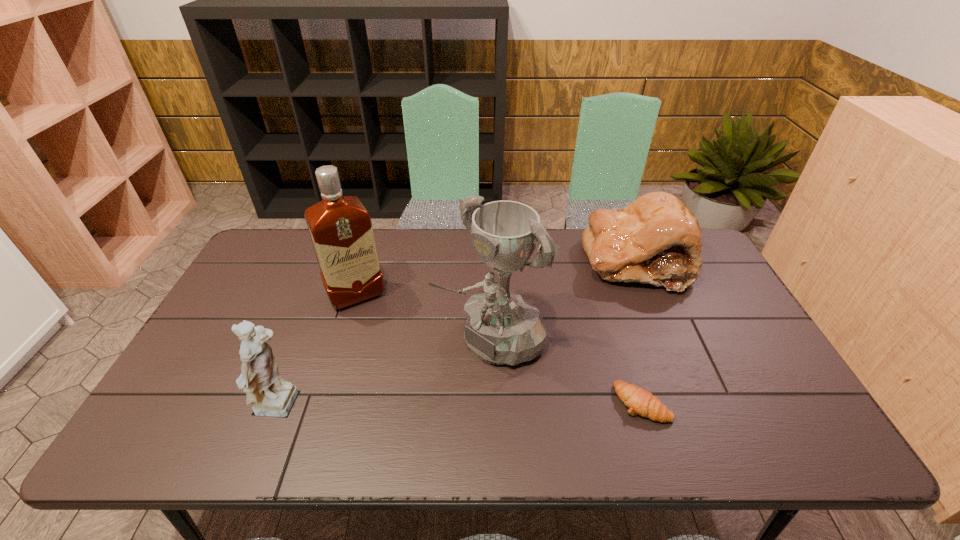
This screenshot has height=540, width=960. What are the coordinates of `empty location between the liquor and the award` in the screenshot? It's located at (424, 316).

Where is `vacant space that's between the liquor and the third tallest object`? The height and width of the screenshot is (540, 960). vacant space that's between the liquor and the third tallest object is located at coordinates (319, 352).

This screenshot has height=540, width=960. In order to click on empty space between the award and the bread in this screenshot , I will do `click(564, 299)`.

Select which object appears as the closest to the liquor. Please provide its 2D coordinates. Your answer should be formatted as a tuple, i.e. [(x, y)], where the tuple contains the x and y coordinates of a point satisfying the conditions above.

[(503, 328)]

Identify which object is the third nearest to the bread. Please provide its 2D coordinates. Your answer should be formatted as a tuple, i.e. [(x, y)], where the tuple contains the x and y coordinates of a point satisfying the conditions above.

[(340, 227)]

You are a GUI agent. You are given a task and a screenshot of the screen. Output one action in this format:
    pyautogui.click(x=<x>, y=<y>)
    Task: Click on the vacant area in the image that satisfies the following two spatial constraints: 1. on the back side of the bread; 2. on the right side of the crescent roll
    
    Given the screenshot: What is the action you would take?
    pyautogui.click(x=597, y=261)

Where is `vacant space that satisfies the following two spatial constraints: 1. on the back side of the bread; 2. on the right side of the third object from right to left`? The image size is (960, 540). vacant space that satisfies the following two spatial constraints: 1. on the back side of the bread; 2. on the right side of the third object from right to left is located at coordinates (490, 261).